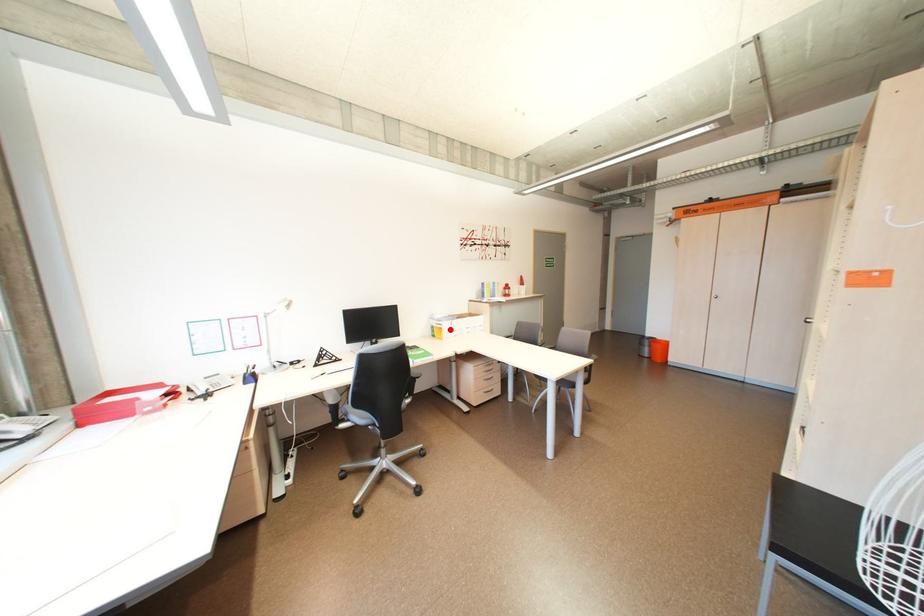
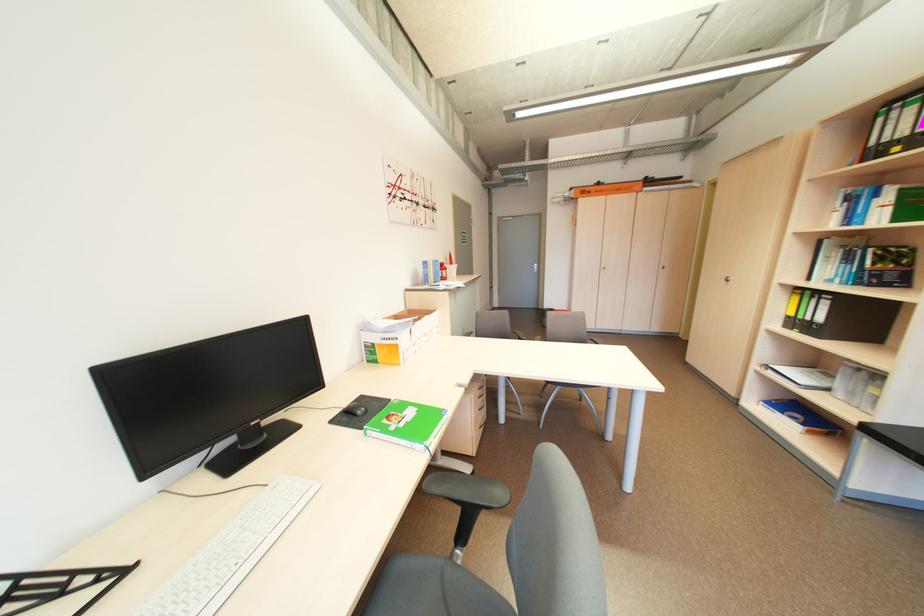
Locate, in the second image, the point that corresponds to the highlighted location in the first image.

(406, 347)